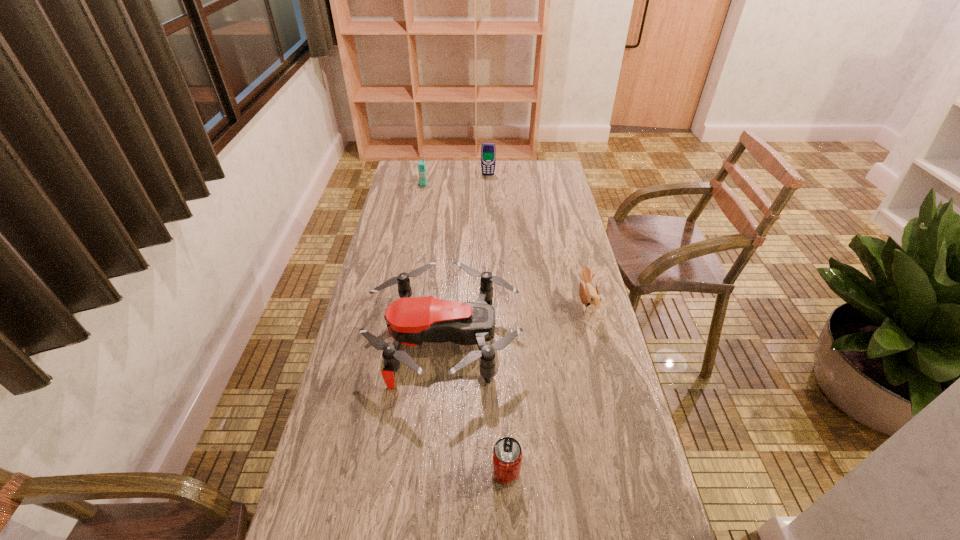
Identify the location of free space that satisfies the following two spatial constraints: 1. on the front-facing side of the pop soda; 2. on the left side of the farthest object. (496, 473).

Where is `vacant point that satisfies the following two spatial constraints: 1. at the beak of the bird; 2. on the front side of the nearest object`? Image resolution: width=960 pixels, height=540 pixels. vacant point that satisfies the following two spatial constraints: 1. at the beak of the bird; 2. on the front side of the nearest object is located at coordinates (629, 473).

This screenshot has height=540, width=960. I want to click on free space that satisfies the following two spatial constraints: 1. on the front-facing side of the farthest object; 2. on the camera side of the drone, so click(492, 339).